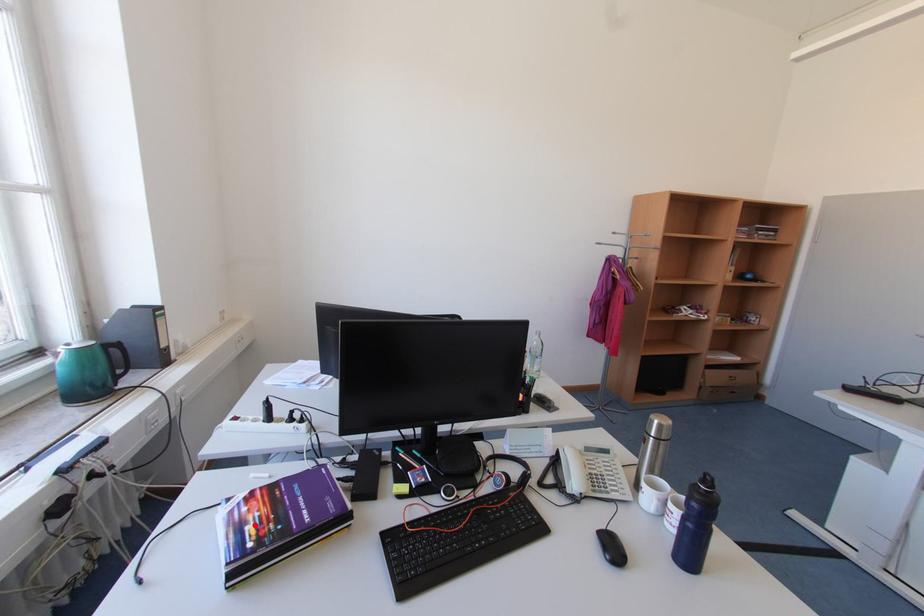
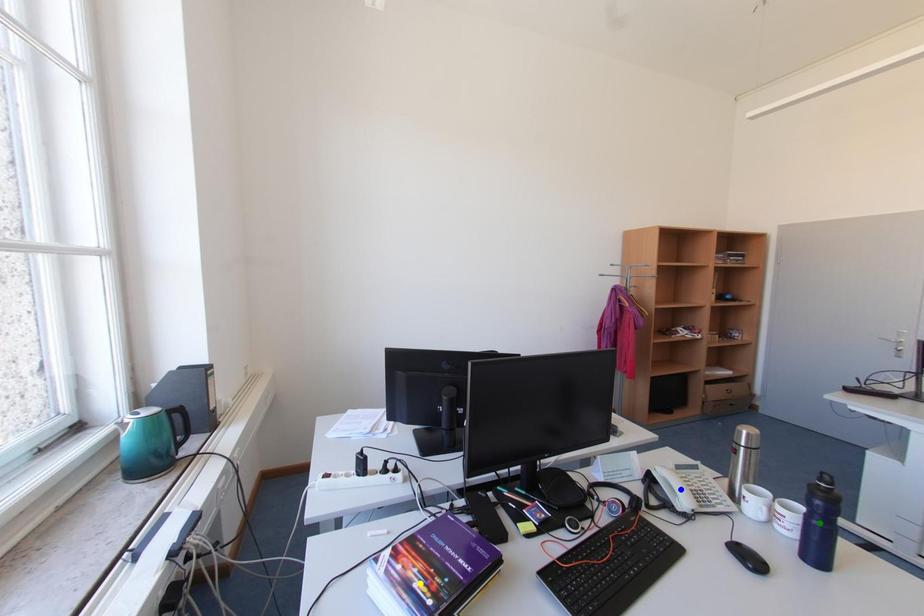
Question: I am providing you with two images of the same scene from different viewpoints. A red point is marked on the first image. You are given multiple points on the second image. Which point in image 2 is actually the same real-world point as the red point in image 1?

Choices:
 (A) green point
 (B) yellow point
 (C) blue point

Answer: (B)